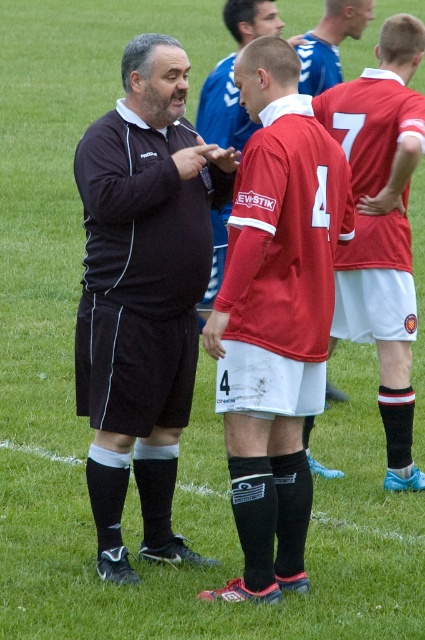
Who is higher up, matte black shorts at center or red matte jersey at center?

red matte jersey at center is above.

This screenshot has width=425, height=640. Describe the element at coordinates (142, 292) in the screenshot. I see `matte black shorts at center` at that location.

Is point (110, 454) more distant than point (388, 157)?

No, it is not.

I want to click on matte black shorts at center, so click(x=142, y=292).

Does point (385, 480) come in front of point (214, 113)?

Yes, it is in front of point (214, 113).

The width and height of the screenshot is (425, 640). Find the location of `red matte jersey at center`. red matte jersey at center is located at coordinates (382, 225).

What do you see at coordinates (142, 292) in the screenshot?
I see `matte black shorts at center` at bounding box center [142, 292].

Is matte black shorts at center bigger than matte red jersey at center?

Indeed, matte black shorts at center has a larger size compared to matte red jersey at center.

Who is more distant from viewer, [161,61] or [209,116]?

The point [209,116] is more distant.

The image size is (425, 640). Find the location of `matte black shorts at center`. matte black shorts at center is located at coordinates [x=142, y=292].